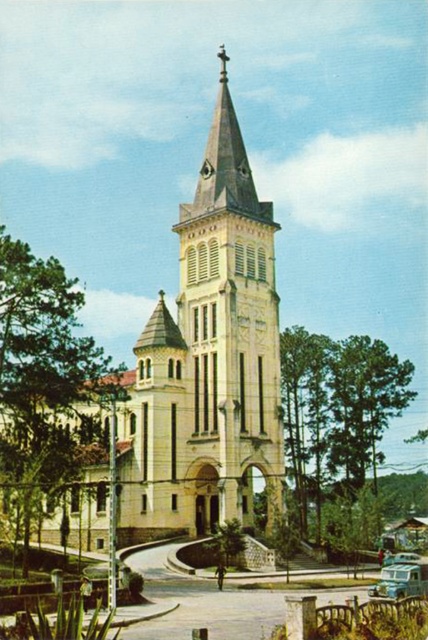
How far apart are green leafy tree at lower right and metallic silver car at lower right?

green leafy tree at lower right is 57.05 feet away from metallic silver car at lower right.

Who is more distant from viewer, (x=368, y=362) or (x=424, y=573)?

Positioned behind is point (x=368, y=362).

Image resolution: width=428 pixels, height=640 pixels. I want to click on green leafy tree at lower right, so click(x=335, y=416).

Is the position of green leafy tree at left more distant than that of green leafy tree at center?

No.

Is green leafy tree at left wider than green leafy tree at center?

Correct, the width of green leafy tree at left exceeds that of green leafy tree at center.

Which is in front, point (71, 378) or point (223, 536)?

Point (223, 536)

I want to click on green leafy tree at left, so click(x=41, y=376).

Which of these two, metallic silver car at lower right or green leafy tree at center, stands shorter?

green leafy tree at center

Who is positioned more to the left, metallic silver car at lower right or green leafy tree at center?

green leafy tree at center

Identify the location of metallic silver car at lower right. This screenshot has height=640, width=428. (401, 580).